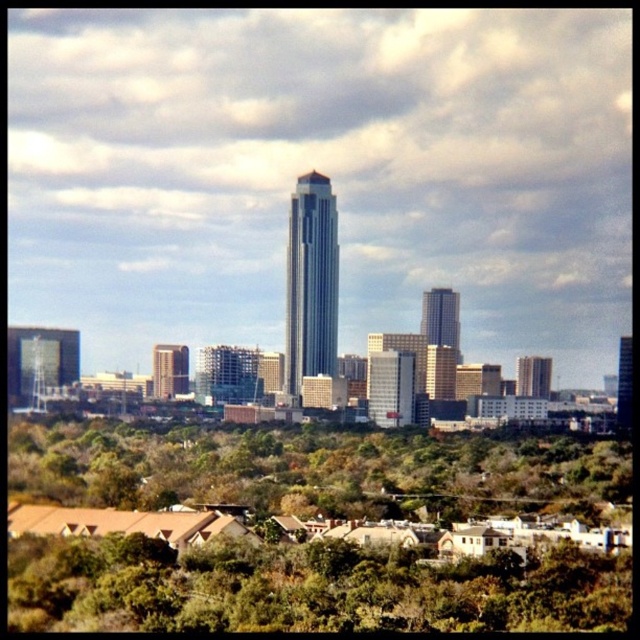
Based on the provided scene description, where is the matte gray building at right located in the image? Please provide its coordinates as a point in the format of a tuple with two decimal numbers between 0 and 1, where the first number represents the x coordinate and the second the y coordinate. The origin point is the bottom left corner of the image.

The matte gray building at right is located at point coordinates of (532, 376).

You are standing in the park area and looking towards the city skyline. Which building is closer to your left side, the silver glass skyscraper at center or the white glass building at center?

The silver glass skyscraper at center is positioned on the left side of the white glass building at center, so it is closer to your left side.

You are an architect reviewing a city model. You notice the matte gray building at right and the matte glass skyscraper at center. Based on their positions in the city layout, which one is positioned higher up in the scene?

The matte gray building at right is located above the matte glass skyscraper at center, so it is positioned higher up in the scene.